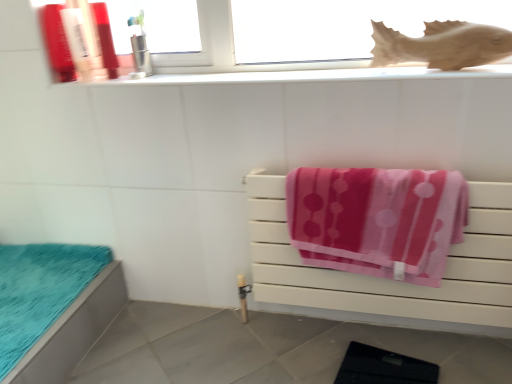
Question: Can you confirm if matte plastic bottle at upper left, the first toiletry when ordered from left to right, is taller than matte plastic bottle at upper left, marked as the third toiletry in a right-to-left arrangement?

Choices:
 (A) yes
 (B) no

Answer: (A)

Question: From a real-world perspective, is matte plastic bottle at upper left, acting as the 4th toiletry starting from the right, on top of matte plastic bottle at upper left, marked as the third toiletry in a right-to-left arrangement?

Choices:
 (A) yes
 (B) no

Answer: (A)

Question: Is the position of matte plastic bottle at upper left, the first toiletry when ordered from left to right, less distant than that of matte plastic bottle at upper left, marked as the third toiletry in a right-to-left arrangement?

Choices:
 (A) no
 (B) yes

Answer: (B)

Question: From a real-world perspective, is matte plastic bottle at upper left, acting as the 4th toiletry starting from the right, under matte plastic bottle at upper left, marked as the 2th toiletry in a left-to-right arrangement?

Choices:
 (A) yes
 (B) no

Answer: (B)

Question: Is matte plastic bottle at upper left, the first toiletry when ordered from left to right, with matte plastic bottle at upper left, marked as the 2th toiletry in a left-to-right arrangement?

Choices:
 (A) yes
 (B) no

Answer: (A)

Question: Considering the relative positions of matte plastic bottle at upper left, acting as the 4th toiletry starting from the right, and matte plastic bottle at upper left, marked as the third toiletry in a right-to-left arrangement, in the image provided, is matte plastic bottle at upper left, acting as the 4th toiletry starting from the right, to the left of matte plastic bottle at upper left, marked as the third toiletry in a right-to-left arrangement, from the viewer's perspective?

Choices:
 (A) yes
 (B) no

Answer: (A)

Question: Is the depth of metallic toothbrush holder at upper left, arranged as the 4th toiletry when viewed from the left, greater than that of white glossy window sill at upper center?

Choices:
 (A) yes
 (B) no

Answer: (A)

Question: Does metallic toothbrush holder at upper left, arranged as the 4th toiletry when viewed from the left, turn towards white glossy window sill at upper center?

Choices:
 (A) no
 (B) yes

Answer: (B)

Question: Does metallic toothbrush holder at upper left, marked as the first toiletry in a right-to-left arrangement, have a lesser height compared to white glossy window sill at upper center?

Choices:
 (A) yes
 (B) no

Answer: (B)

Question: From a real-world perspective, is metallic toothbrush holder at upper left, marked as the first toiletry in a right-to-left arrangement, under white glossy window sill at upper center?

Choices:
 (A) yes
 (B) no

Answer: (B)

Question: Does metallic toothbrush holder at upper left, arranged as the 4th toiletry when viewed from the left, contain white glossy window sill at upper center?

Choices:
 (A) yes
 (B) no

Answer: (B)

Question: Does metallic toothbrush holder at upper left, marked as the first toiletry in a right-to-left arrangement, have a lesser width compared to white glossy window sill at upper center?

Choices:
 (A) no
 (B) yes

Answer: (B)

Question: Considering the relative positions of brown matte fish at upper right and pink soft towel at center right in the image provided, is brown matte fish at upper right to the right of pink soft towel at center right from the viewer's perspective?

Choices:
 (A) yes
 (B) no

Answer: (A)